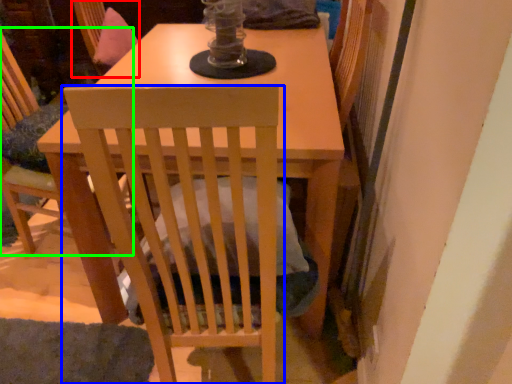
Question: Which object is the farthest from swivel chair (highlighted by a red box)? Choose among these: chair (highlighted by a blue box) or chair (highlighted by a green box).

Choices:
 (A) chair
 (B) chair

Answer: (A)